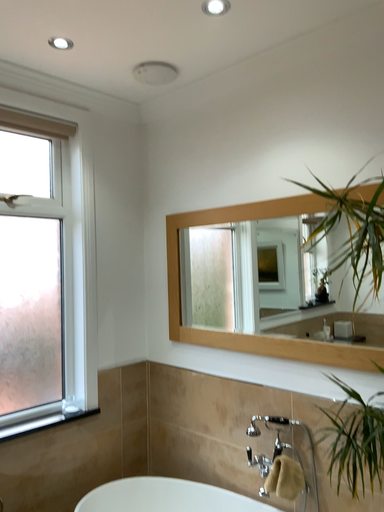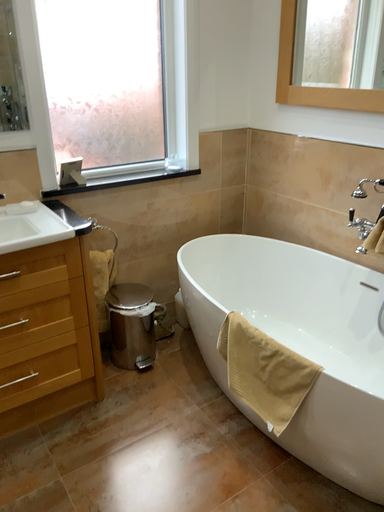
Question: How did the camera likely rotate when shooting the video?

Choices:
 (A) rotated upward
 (B) rotated downward

Answer: (B)